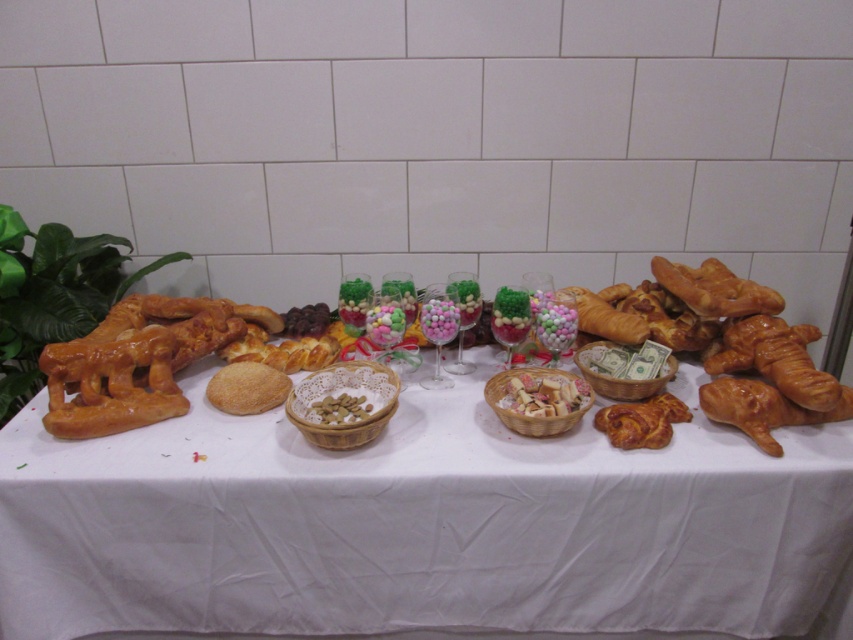
Question: Which object is positioned farthest from the golden matte bread at center?

Choices:
 (A) golden brown croissant at center
 (B) multicolored sugar-coated candies at center
 (C) golden glazed pretzels at left

Answer: (A)

Question: Is golden matte bread at center below golden brown croissant at center?

Choices:
 (A) yes
 (B) no

Answer: (A)

Question: Does white cloth at center lie in front of golden matte bread at center?

Choices:
 (A) yes
 (B) no

Answer: (A)

Question: Is golden matte bread at center closer to the viewer compared to golden brown croissant at center?

Choices:
 (A) no
 (B) yes

Answer: (B)

Question: Which object appears farthest from the camera in this image?

Choices:
 (A) golden brown croissant at center
 (B) golden glazed pretzels at left

Answer: (A)

Question: Based on their relative distances, which object is nearer to the golden brown pretzel at left?

Choices:
 (A) golden brown croissant at center
 (B) golden glazed pretzels at left
 (C) white cloth at center
 (D) golden matte bread at center

Answer: (D)